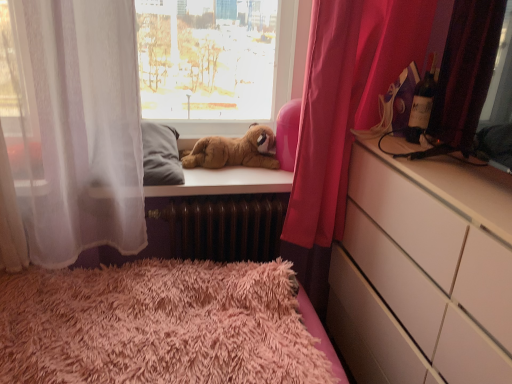
Question: Considering the relative positions of pink fabric curtain at right, acting as the second curtain starting from the front, and matte glass bottle at right in the image provided, is pink fabric curtain at right, acting as the second curtain starting from the front, to the right of matte glass bottle at right from the viewer's perspective?

Choices:
 (A) yes
 (B) no

Answer: (B)

Question: Considering the relative sizes of pink fabric curtain at right, which is the 1th curtain in back-to-front order, and matte glass bottle at right in the image provided, is pink fabric curtain at right, which is the 1th curtain in back-to-front order, shorter than matte glass bottle at right?

Choices:
 (A) no
 (B) yes

Answer: (A)

Question: Can you confirm if pink fabric curtain at right, acting as the second curtain starting from the front, is taller than matte glass bottle at right?

Choices:
 (A) no
 (B) yes

Answer: (B)

Question: From a real-world perspective, is pink fabric curtain at right, acting as the second curtain starting from the front, physically below matte glass bottle at right?

Choices:
 (A) yes
 (B) no

Answer: (A)

Question: Is pink fabric curtain at right, acting as the second curtain starting from the front, not near matte glass bottle at right?

Choices:
 (A) yes
 (B) no

Answer: (B)

Question: Considering the relative positions of pink fabric curtain at right, which is the 1th curtain in back-to-front order, and matte glass bottle at right in the image provided, is pink fabric curtain at right, which is the 1th curtain in back-to-front order, to the left of matte glass bottle at right from the viewer's perspective?

Choices:
 (A) yes
 (B) no

Answer: (A)

Question: Are matte glass bottle at right and brown plush bear at upper center beside each other?

Choices:
 (A) no
 (B) yes

Answer: (A)

Question: Considering the relative sizes of matte glass bottle at right and brown plush bear at upper center in the image provided, is matte glass bottle at right smaller than brown plush bear at upper center?

Choices:
 (A) no
 (B) yes

Answer: (B)

Question: Is matte glass bottle at right completely or partially outside of brown plush bear at upper center?

Choices:
 (A) yes
 (B) no

Answer: (A)

Question: Is matte glass bottle at right positioned before brown plush bear at upper center?

Choices:
 (A) yes
 (B) no

Answer: (A)

Question: Is matte glass bottle at right facing towards brown plush bear at upper center?

Choices:
 (A) no
 (B) yes

Answer: (A)

Question: Can you confirm if matte glass bottle at right is positioned to the left of brown plush bear at upper center?

Choices:
 (A) yes
 (B) no

Answer: (B)

Question: Does brown plush bear at upper center appear on the left side of pink fabric curtain at right, acting as the second curtain starting from the front?

Choices:
 (A) no
 (B) yes

Answer: (B)